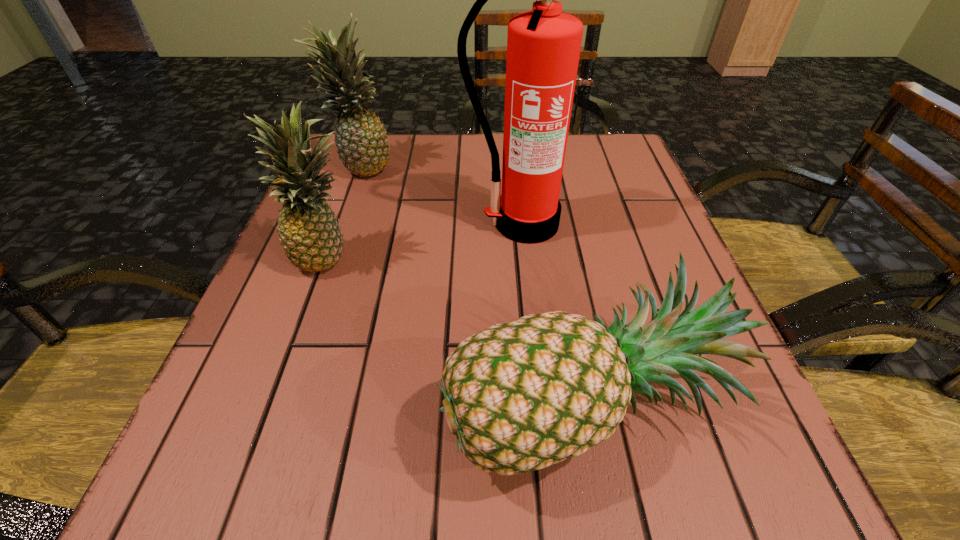
Image resolution: width=960 pixels, height=540 pixels. I want to click on the tallest object, so click(543, 45).

Locate an element on the screen. This screenshot has width=960, height=540. the farthest pineapple is located at coordinates (x=361, y=141).

Identify the location of the second farthest pineapple. (309, 232).

Locate an element on the screen. the nearest pineapple is located at coordinates (520, 396).

The height and width of the screenshot is (540, 960). Find the location of `the shortest object`. the shortest object is located at coordinates (520, 396).

Find the location of a particular element. The width and height of the screenshot is (960, 540). vacant space located with the nozzle aimed from the tallest object is located at coordinates (527, 262).

At what (x,y) coordinates should I click in order to perform the action: click on vacant space located on the front of the farthest object. Please return your answer as a coordinate pair (x, y). The width and height of the screenshot is (960, 540). Looking at the image, I should click on (316, 299).

What are the coordinates of `free spot located 0.370m on the right of the second nearest pineapple` in the screenshot? It's located at (564, 256).

Find the location of a particular element. free space located 0.130m on the left of the nearest object is located at coordinates (349, 399).

The height and width of the screenshot is (540, 960). I want to click on object that is at the far edge, so click(361, 141).